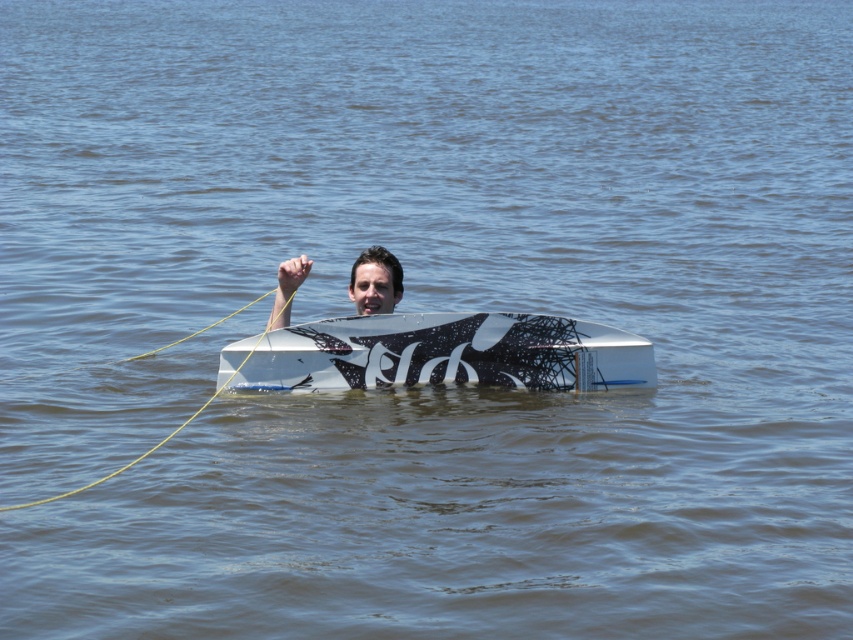
You are a surfer trying to choose between the white matte surfboard at center and the matte black surfboard at center. Based on the scene, which surfboard has a greater width?

The white matte surfboard at center has a greater width than the matte black surfboard at center.

You are a surfer trying to choose between the white matte surfboard at center and the matte black surfboard at center. Based on the scene, which one is taller?

The white matte surfboard at center is taller than the matte black surfboard at center according to the description.

You are a lifeguard observing the scene from a tower. You see a person holding a yellow rope attached to a white matte surfboard at center. The rope is 2 meters long. The person is holding the surfboard at point (440, 353). If the person moves the surfboard 0.1 units to the right along the x axis, what will be the new coordinates of the surfboard?

Moving the surfboard 0.1 units to the right along the x axis would add 0.1 to the original x coordinate of 0.553, resulting in new coordinates of 0.653, 0.518.